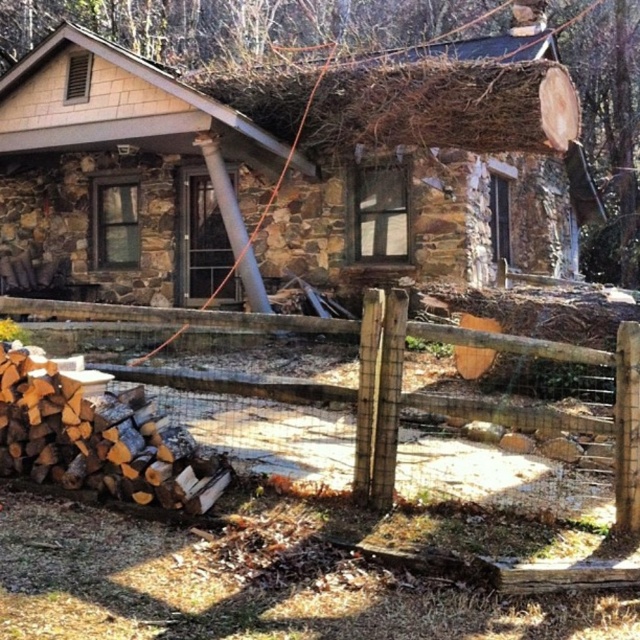
Question: Is brown stone cabin at upper center behind brown wooden fence at lower left?

Choices:
 (A) no
 (B) yes

Answer: (B)

Question: Is brown stone cabin at upper center to the left of brown wooden fence at lower left from the viewer's perspective?

Choices:
 (A) no
 (B) yes

Answer: (B)

Question: Which point appears farthest from the camera in this image?

Choices:
 (A) tap(266, 396)
 (B) tap(554, 61)

Answer: (B)

Question: Is brown stone cabin at upper center bigger than brown wooden fence at lower left?

Choices:
 (A) no
 (B) yes

Answer: (B)